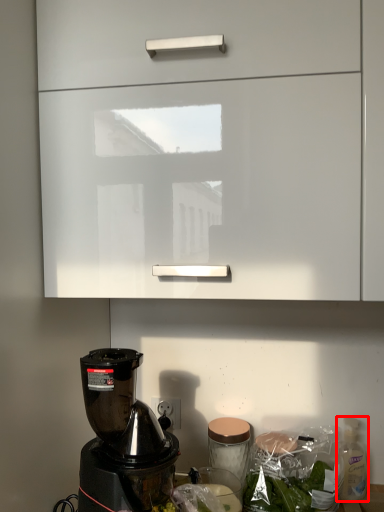
Question: From the image's perspective, what is the correct spatial relationship of bottle (annotated by the red box) in relation to cabinetry?

Choices:
 (A) below
 (B) above

Answer: (A)